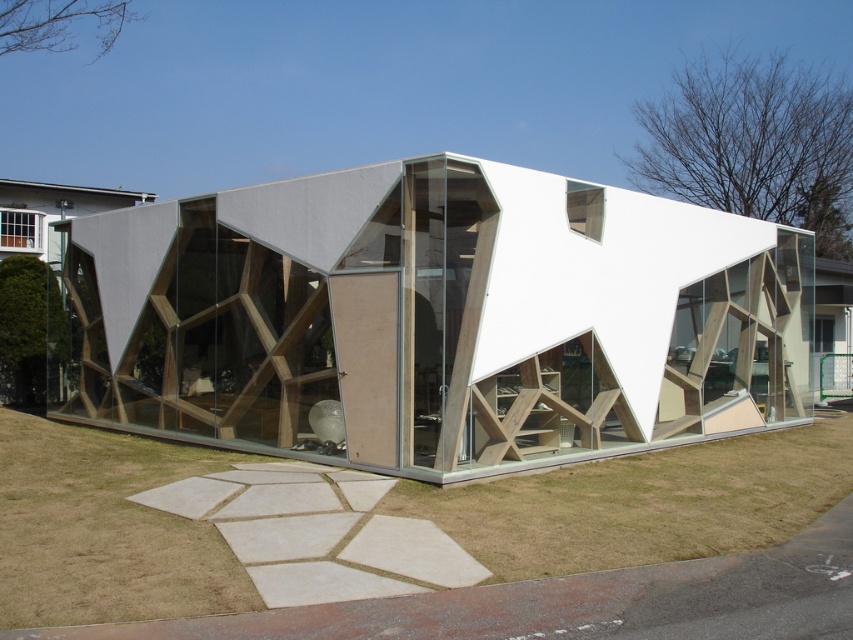
Question: Which point is farther from the camera taking this photo?

Choices:
 (A) (206, 371)
 (B) (21, 595)

Answer: (A)

Question: Which point appears farthest from the camera in this image?

Choices:
 (A) (67, 618)
 (B) (772, 227)

Answer: (B)

Question: Which of the following is the farthest from the observer?

Choices:
 (A) (553, 182)
 (B) (502, 561)

Answer: (A)

Question: From the image, what is the correct spatial relationship of white matte wooden structure at center in relation to green grass at lower center?

Choices:
 (A) below
 (B) above

Answer: (B)

Question: Can you confirm if white matte wooden structure at center is positioned above green grass at lower center?

Choices:
 (A) yes
 (B) no

Answer: (A)

Question: Can you confirm if white matte wooden structure at center is positioned above green grass at lower center?

Choices:
 (A) yes
 (B) no

Answer: (A)